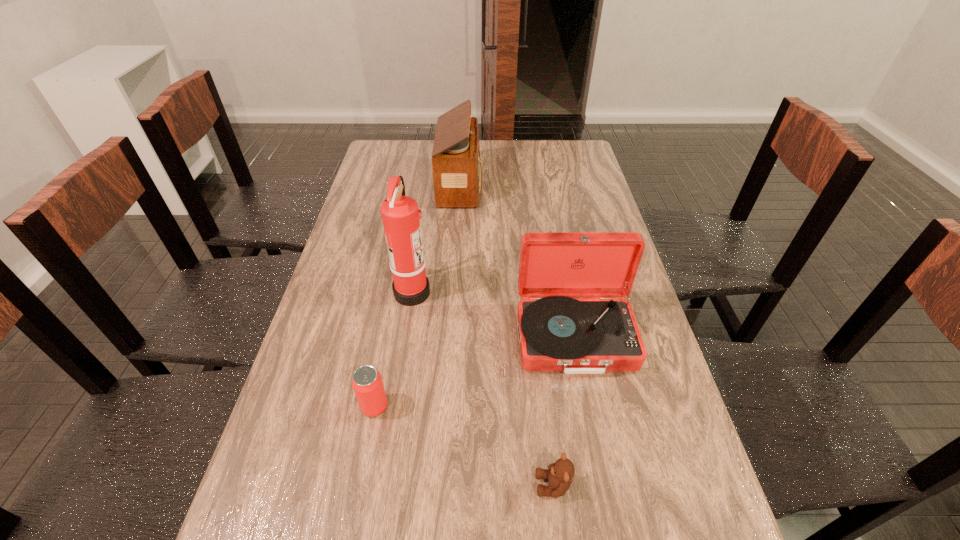
Identify which object is located as the nearest to the farthest object. Please provide its 2D coordinates. Your answer should be formatted as a tuple, i.e. [(x, y)], where the tuple contains the x and y coordinates of a point satisfying the conditions above.

[(400, 214)]

Find the location of `vacant space that satisfies the following two spatial constraints: 1. on the front-facing side of the phonograph_record; 2. on the face of the teddy bear`. vacant space that satisfies the following two spatial constraints: 1. on the front-facing side of the phonograph_record; 2. on the face of the teddy bear is located at coordinates (604, 485).